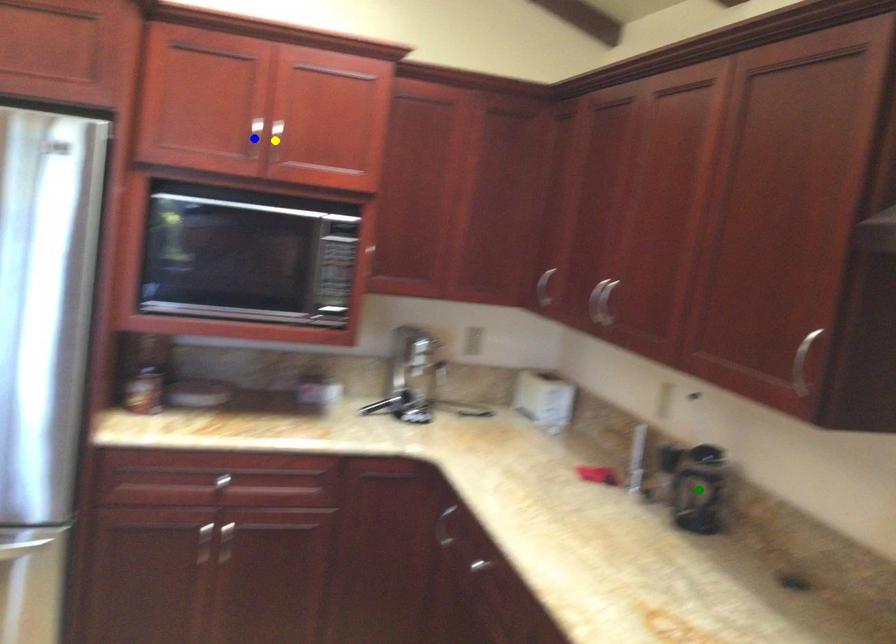
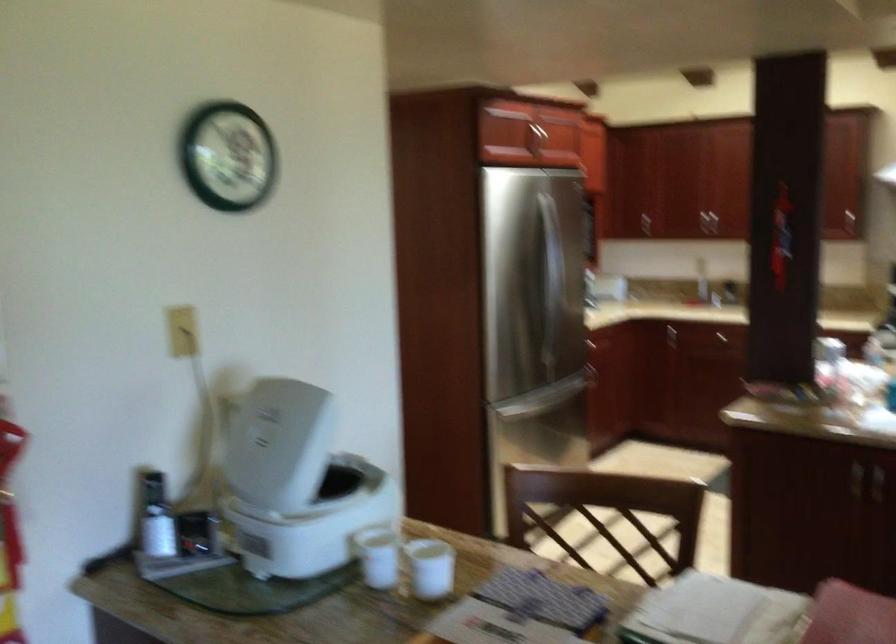
I am providing you with two images of the same scene from different viewpoints. Three points are marked in image1. Which point corresponds to a part or object that is occluded in image2?In image1, three points are marked. Which of them correspond to a part or object that is occluded in image2?Among the three points shown in image1, which one corresponds to a part or object that is no longer visible due to occlusion in image2?

blue point, green point, yellow point cannot be seen in image2.